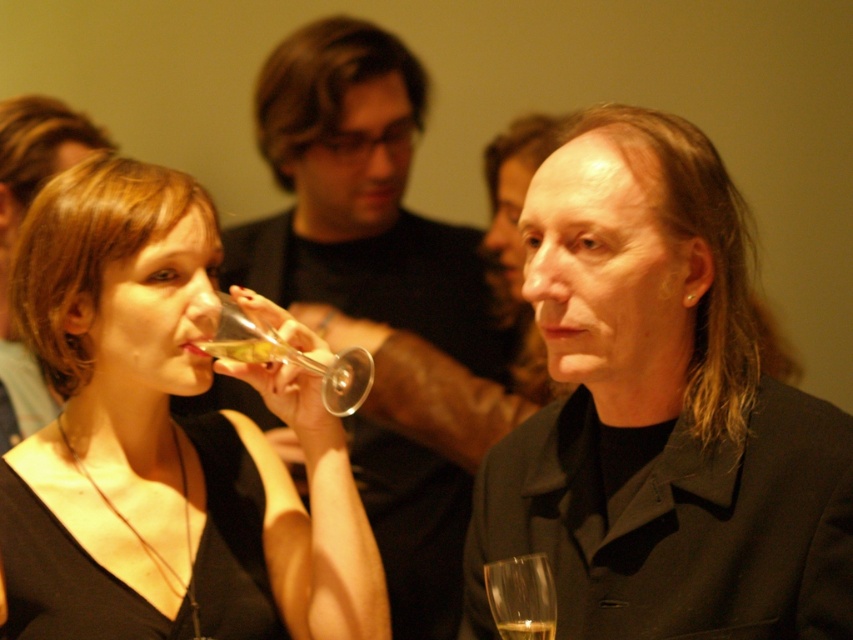
Question: Can you confirm if matte black shirt at center is wider than translucent glass wine glass at upper center?

Choices:
 (A) yes
 (B) no

Answer: (A)

Question: Which of the following is the farthest from the observer?

Choices:
 (A) (114, 372)
 (B) (531, 624)
 (C) (250, 337)
 (D) (544, 632)

Answer: (A)

Question: Which object appears closest to the camera in this image?

Choices:
 (A) clear glass wine glass at lower center
 (B) matte black jacket at center
 (C) matte black dress at center
 (D) translucent glass wine glass at upper center

Answer: (A)

Question: Is matte black jacket at center wider than translucent glass at lower right?

Choices:
 (A) no
 (B) yes

Answer: (B)

Question: Which object appears farthest from the camera in this image?

Choices:
 (A) matte black dress at center
 (B) translucent glass at lower right
 (C) matte black jacket at center
 (D) matte black shirt at center

Answer: (D)

Question: Does matte black jacket at center lie behind matte black shirt at center?

Choices:
 (A) no
 (B) yes

Answer: (A)